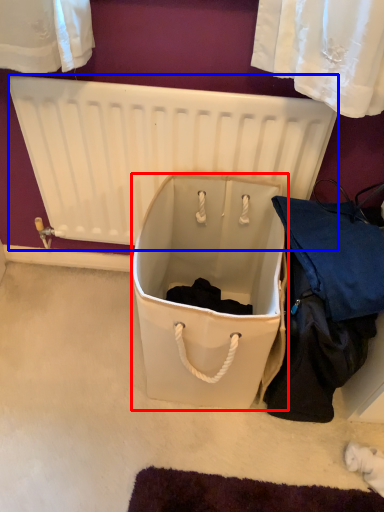
Question: Among these objects, which one is farthest to the camera, storage box (highlighted by a red box) or radiator (highlighted by a blue box)?

Choices:
 (A) storage box
 (B) radiator

Answer: (B)